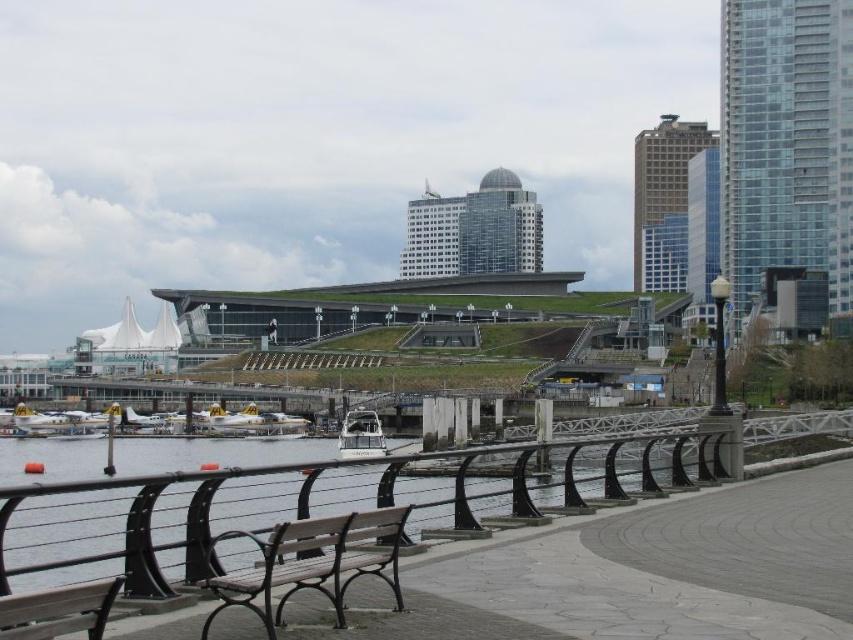
Question: Observing the image, what is the correct spatial positioning of black metal railing at lower left in reference to wooden bench at lower left?

Choices:
 (A) left
 (B) right

Answer: (B)

Question: Which of the following is the closest to the observer?

Choices:
 (A) (352, 536)
 (B) (25, 502)

Answer: (A)

Question: Considering the real-world distances, which object is farthest from the wooden bench at lower center?

Choices:
 (A) black metal railing at lower left
 (B) white glossy boat at center
 (C) wooden bench at lower left

Answer: (B)

Question: Which object is farther from the camera taking this photo?

Choices:
 (A) wooden bench at lower left
 (B) black metal railing at lower left
 (C) wooden bench at lower center
 (D) white glossy boat at center

Answer: (D)

Question: Does black metal railing at lower left appear under wooden bench at lower center?

Choices:
 (A) no
 (B) yes

Answer: (B)

Question: Is wooden bench at lower center further to the viewer compared to white glossy boat at center?

Choices:
 (A) yes
 (B) no

Answer: (B)